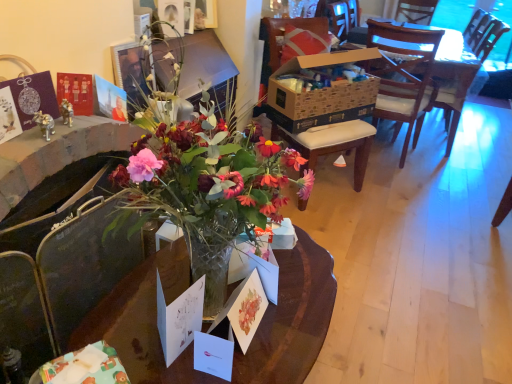
At what (x,y) coordinates should I click in order to perform the action: click on vacant space situated above brown cardboard box at center, placed as the 2th box when sorted from left to right (from a real-world perspective). Please return your answer as a coordinate pair (x, y). The height and width of the screenshot is (384, 512). Looking at the image, I should click on (327, 49).